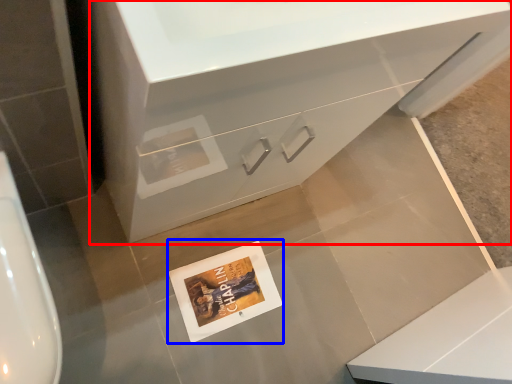
Question: Which object is closer to the camera taking this photo, bathroom cabinet (highlighted by a red box) or postcard (highlighted by a blue box)?

Choices:
 (A) bathroom cabinet
 (B) postcard

Answer: (A)